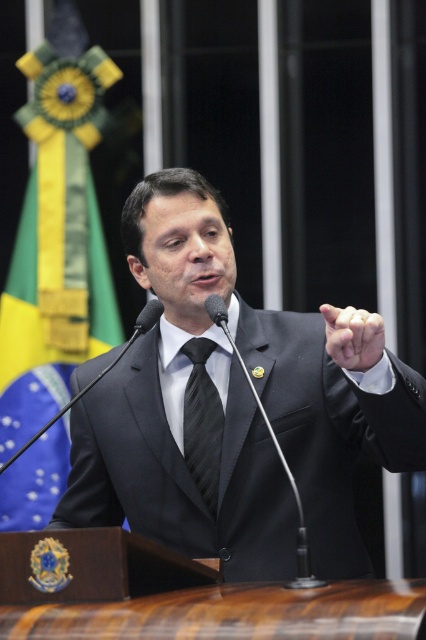
Question: Which point is farther to the camera?

Choices:
 (A) (209, 296)
 (B) (210, 346)
 (C) (196, 493)

Answer: (B)

Question: Considering the relative positions of black striped tie at center and black matte microphone at center in the image provided, where is black striped tie at center located with respect to black matte microphone at center?

Choices:
 (A) left
 (B) right

Answer: (B)

Question: Can you confirm if black matte suit at center is wider than black matte microphone at center?

Choices:
 (A) no
 (B) yes

Answer: (B)

Question: Does black matte suit at center have a greater width compared to black plastic microphone at center?

Choices:
 (A) no
 (B) yes

Answer: (B)

Question: Among these objects, which one is farthest from the camera?

Choices:
 (A) black matte microphone at center
 (B) black striped tie at center

Answer: (B)

Question: Which point appears closest to the camera in this image?

Choices:
 (A) (394, 417)
 (B) (143, 324)

Answer: (A)